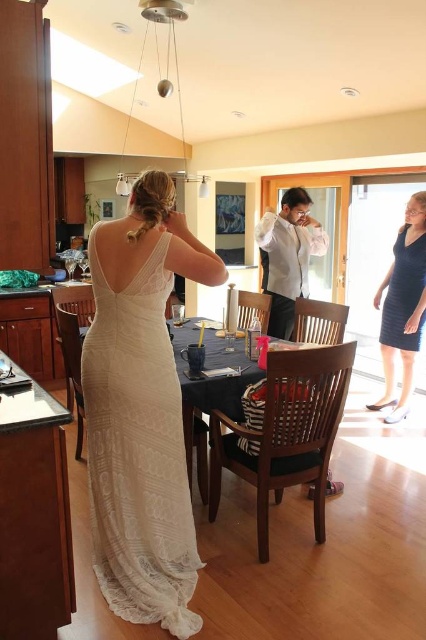
You are a stylist preparing for a client who needs to choose between the dark blue textured dress at lower right and the black matte dress at right. Based on their height, which dress might be more suitable?

The dark blue textured dress at lower right is taller than the black matte dress at right, so it might be more suitable for someone with a taller frame.

You are a stylist preparing for a photoshoot and need to choose between the dark blue textured dress at lower right and the black matte dress at right. Based on their positions in the image, which dress is closer to the kitchen counter on the left?

The dark blue textured dress at lower right is closer to the kitchen counter on the left because it is positioned to the left of the black matte dress at right.

Where is the white lace dress at center located in the image?

The white lace dress at center is located at point 2D coordinates (138, 451).